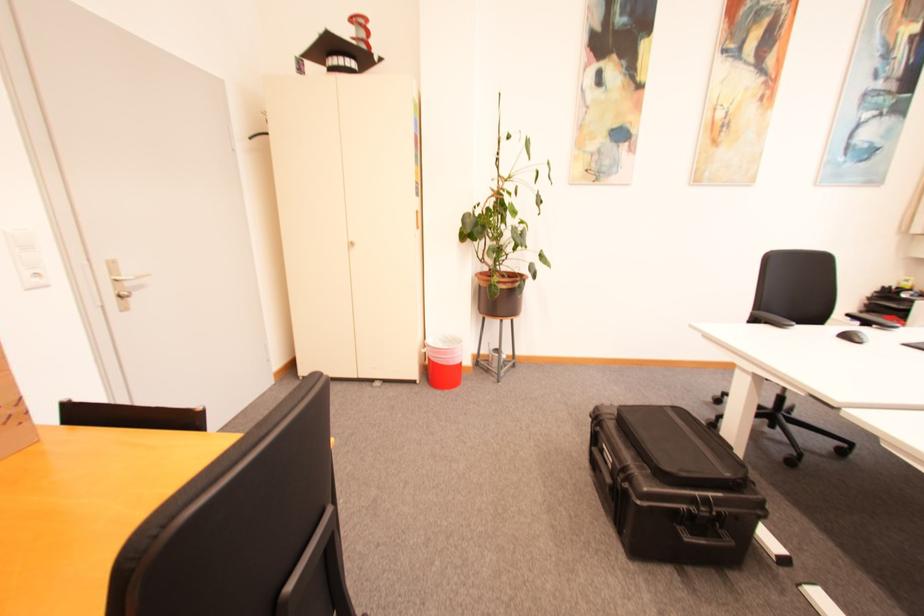
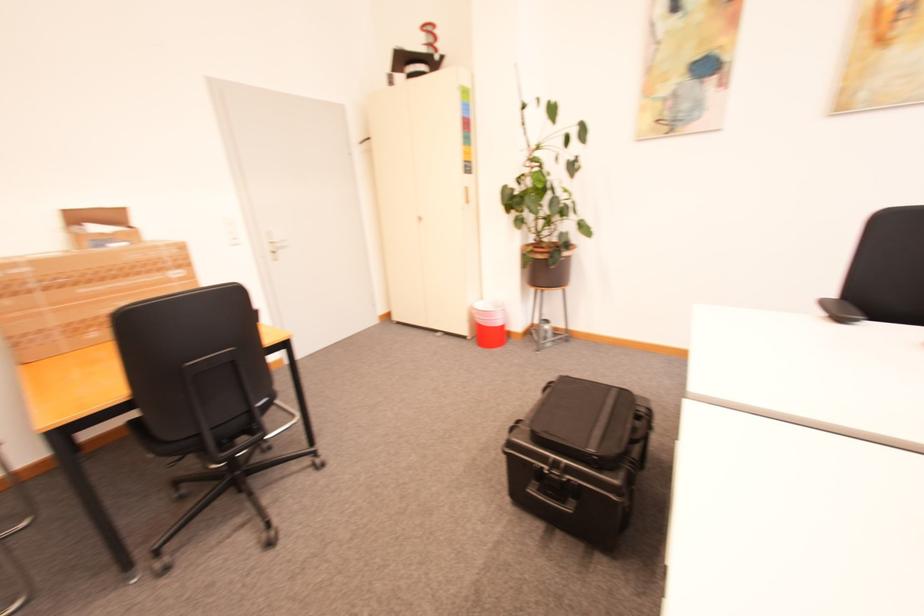
Find the pixel in the second image that matches (x=721, y=499) in the first image.

(574, 467)